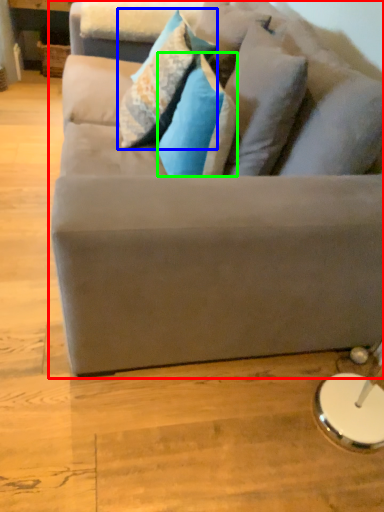
Question: Based on their relative distances, which object is nearer to studio couch (highlighted by a red box)? Choose from pillow (highlighted by a blue box) and pillow (highlighted by a green box).

Choices:
 (A) pillow
 (B) pillow

Answer: (B)